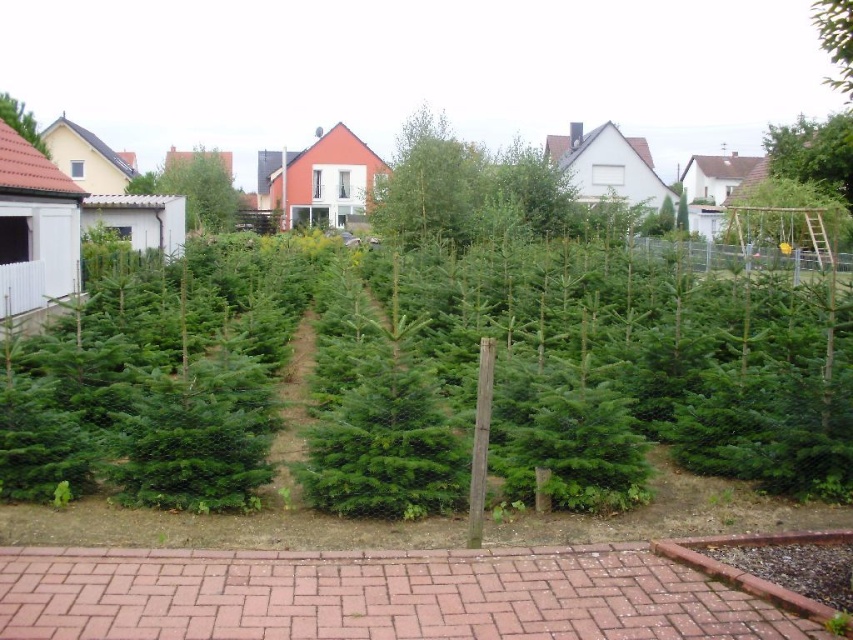
Can you confirm if green leafy plants at center is positioned to the right of green needle-like at upper left?

Indeed, green leafy plants at center is positioned on the right side of green needle-like at upper left.

Between point (286, 342) and point (45, 148), which one is positioned behind?

Point (45, 148)

Where is `green leafy plants at center`? green leafy plants at center is located at coordinates (444, 372).

You are a GUI agent. You are given a task and a screenshot of the screen. Output one action in this format:
    pyautogui.click(x=<x>, y=<y>)
    Task: Click on the green leafy plants at center
    This screenshot has height=640, width=853.
    Given the screenshot: What is the action you would take?
    pyautogui.click(x=444, y=372)

Which is more to the left, green leafy tree at upper right or green needle-like at upper left?

green needle-like at upper left

Describe the element at coordinates (814, 154) in the screenshot. I see `green leafy tree at upper right` at that location.

Who is more distant from viewer, (793, 150) or (9, 100)?

The point (793, 150) is behind.

Locate an element on the screen. The image size is (853, 640). green leafy tree at upper right is located at coordinates (x=814, y=154).

The width and height of the screenshot is (853, 640). What do you see at coordinates (444, 372) in the screenshot?
I see `green leafy plants at center` at bounding box center [444, 372].

Is point (471, 385) in front of point (215, 198)?

Yes, point (471, 385) is closer to viewer.

This screenshot has width=853, height=640. What are the coordinates of `green leafy plants at center` in the screenshot? It's located at (444, 372).